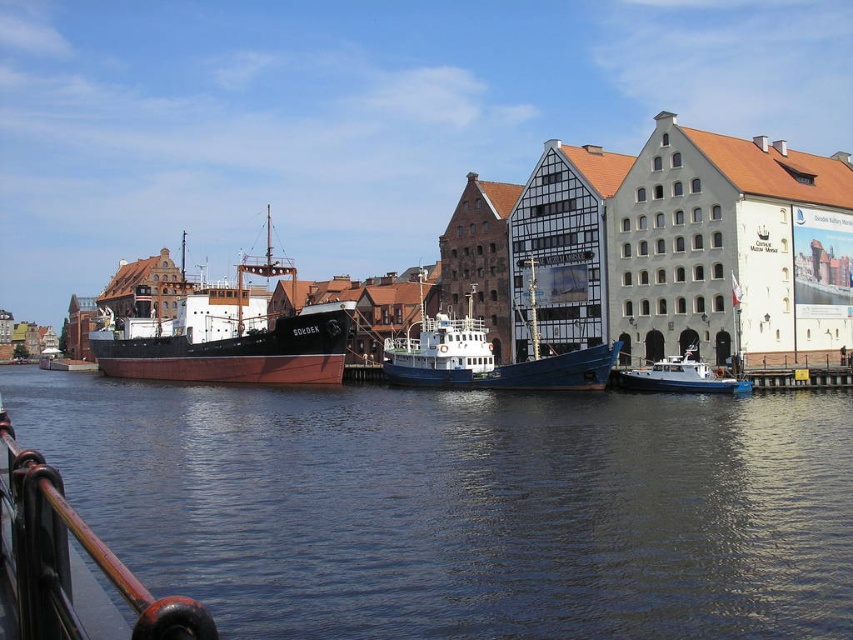
Who is lower down, dark blue water at center or polished metal railing at lower left?

polished metal railing at lower left is below.

Describe the element at coordinates (462, 508) in the screenshot. I see `dark blue water at center` at that location.

Locate an element on the screen. Image resolution: width=853 pixels, height=640 pixels. dark blue water at center is located at coordinates (462, 508).

Where is `dark blue water at center`? Image resolution: width=853 pixels, height=640 pixels. dark blue water at center is located at coordinates (462, 508).

Which of these two, brown matte ship at left or blue polished wood boat at center, stands shorter?

blue polished wood boat at center is shorter.

Is point (172, 348) closer to camera compared to point (438, 346)?

No, it is behind (438, 346).

Is point (286, 356) positioned in front of point (544, 376)?

That is False.

Where is `brown matte ship at left`? Image resolution: width=853 pixels, height=640 pixels. brown matte ship at left is located at coordinates (230, 337).

Is brown matte ship at left thinner than white matte boat at lower right?

No.

Is point (108, 317) behind point (650, 369)?

That is True.

The image size is (853, 640). I want to click on brown matte ship at left, so click(x=230, y=337).